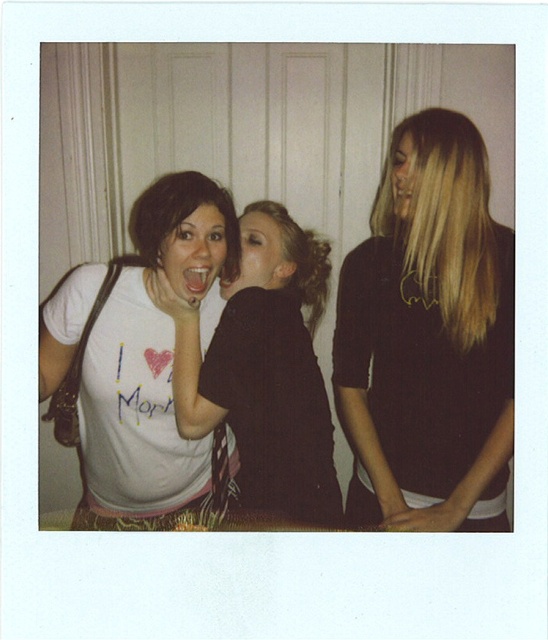
Question: Which object is closer to the camera taking this photo?

Choices:
 (A) dark brown sweater at center
 (B) matte black shirt at center
 (C) matte black mouth at center
 (D) smooth black shirt at right

Answer: (A)

Question: Observing the image, what is the correct spatial positioning of dark brown sweater at center in reference to blonde hair at right?

Choices:
 (A) right
 (B) left

Answer: (B)

Question: Can you confirm if blonde hair at right is positioned below smooth skin face at center?

Choices:
 (A) no
 (B) yes

Answer: (A)

Question: Estimate the real-world distances between objects in this image. Which object is farther from the blonde hair at right?

Choices:
 (A) blonde hair at center
 (B) matte white t-shirt at center-left

Answer: (B)

Question: Which object appears closest to the camera in this image?

Choices:
 (A) white matte t-shirt at left
 (B) matte black shirt at center

Answer: (A)

Question: Is white matte t-shirt at left closer to camera compared to matte black shirt at center?

Choices:
 (A) yes
 (B) no

Answer: (A)